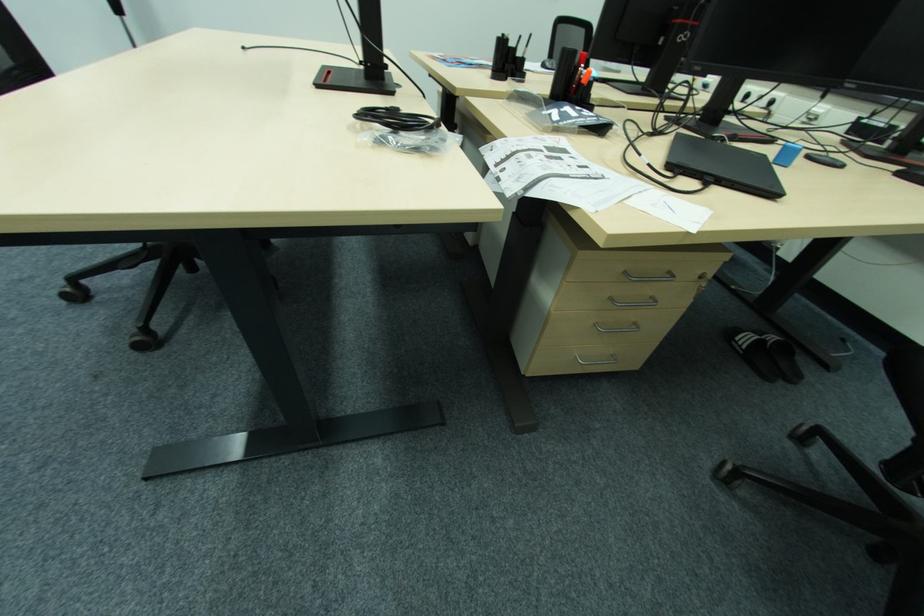
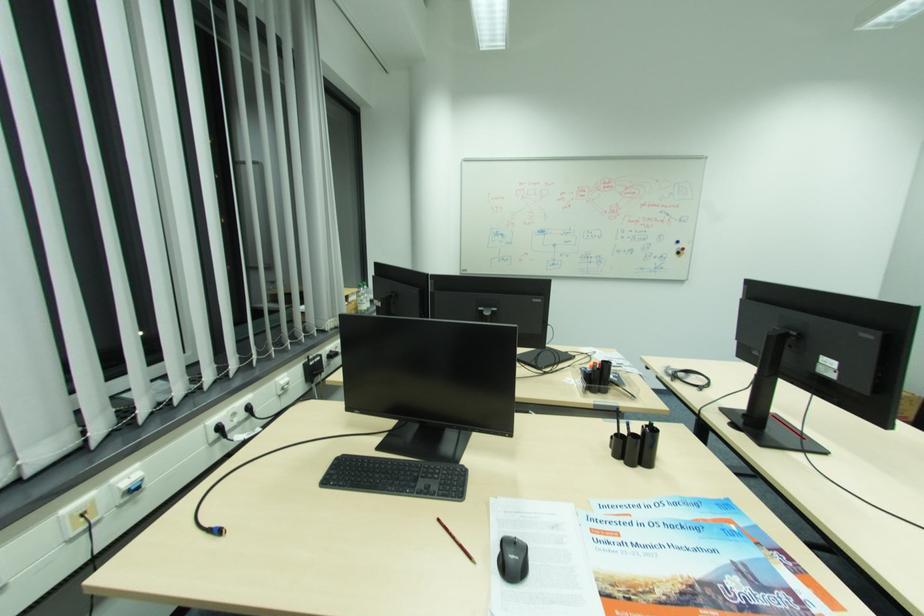
In the second image, find the point that corresponds to the point at 867,121 in the first image.

(311, 365)